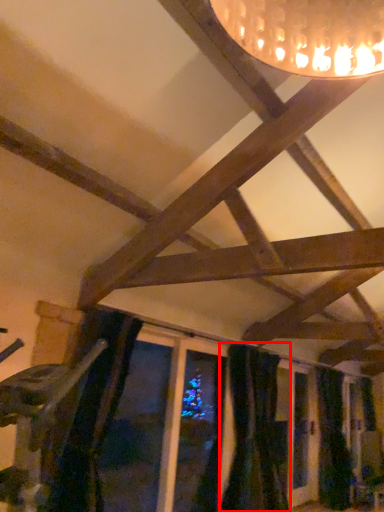
Question: From the image's perspective, considering the relative positions of curtain (annotated by the red box) and curtain in the image provided, where is curtain (annotated by the red box) located with respect to the staircase?

Choices:
 (A) above
 (B) below

Answer: (A)